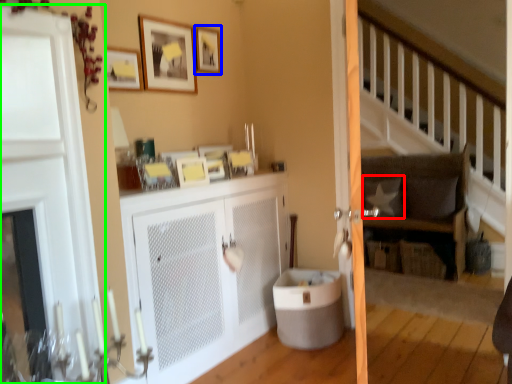
Question: Which is farther away from pillow (highlighted by a red box)? picture frame (highlighted by a blue box) or door (highlighted by a green box)?

Choices:
 (A) picture frame
 (B) door

Answer: (B)